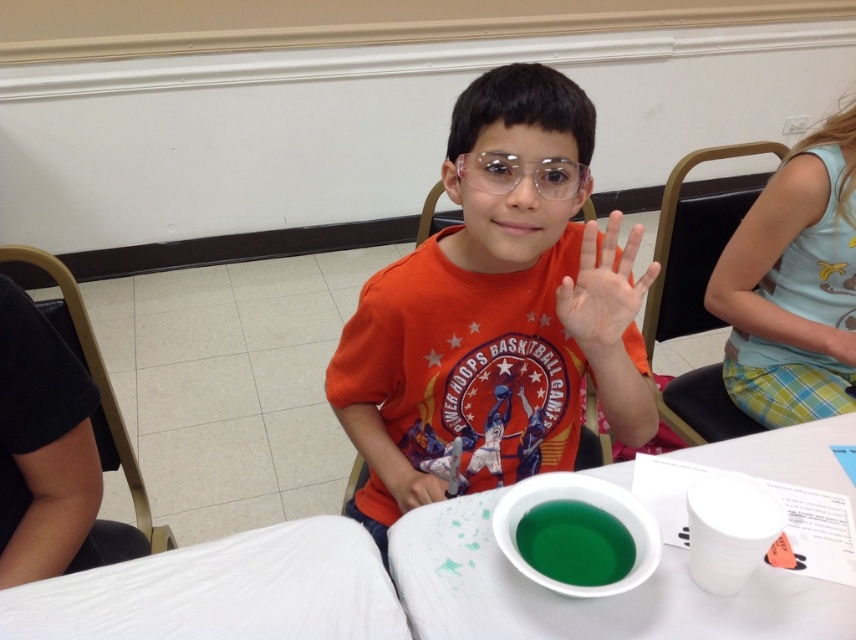
You are a teacher in a classroom and need to place a 24 inch ruler between the white plastic bowl at center and the black fabric at left. Can you fit the ruler between them without overlapping either object?

The distance between the white plastic bowl at center and the black fabric at left is 24.52 inches. Since the ruler is 24 inches long, it can fit between them without overlapping either object.

You are a teacher observing a classroom activity. You notice the white plastic bowl at center and the black fabric at left. Which object is closer to the front of the classroom?

The white plastic bowl at center is closer to the front of the classroom because it is positioned in front of the black fabric at left.

You are a photographer trying to capture a clear picture of the white plastic bowl at center. The orange cotton shirt at center is blocking your view. Can you estimate whether the shirt is large enough to fully cover the bowl if it were placed directly over it?

The orange cotton shirt at center is larger in size than the white plastic bowl at center, so if placed directly over it, the shirt would be large enough to fully cover the bowl.